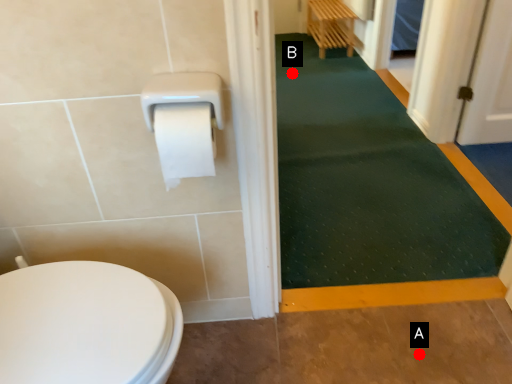
Question: Two points are circled on the image, labeled by A and B beside each circle. Which point is closer to the camera?

Choices:
 (A) A is closer
 (B) B is closer

Answer: (A)